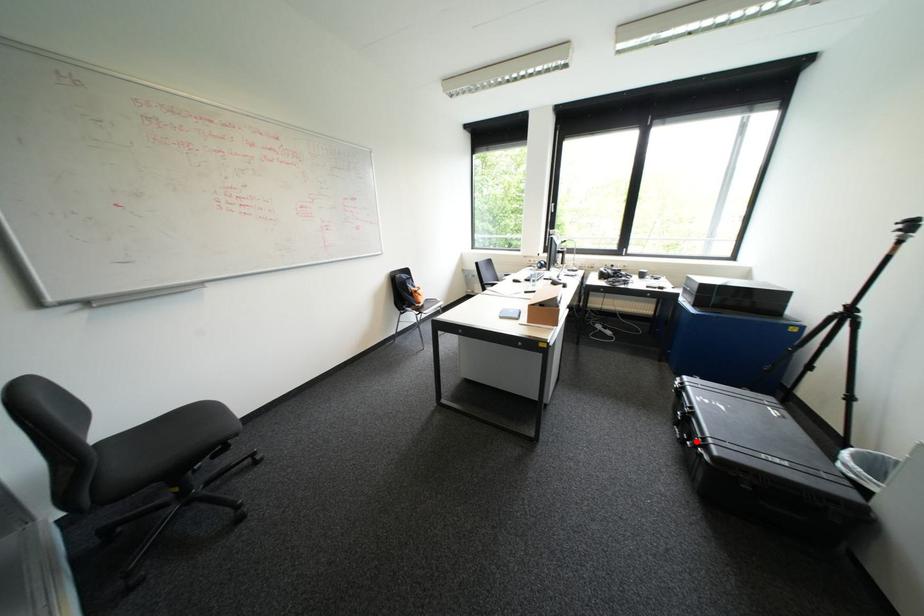
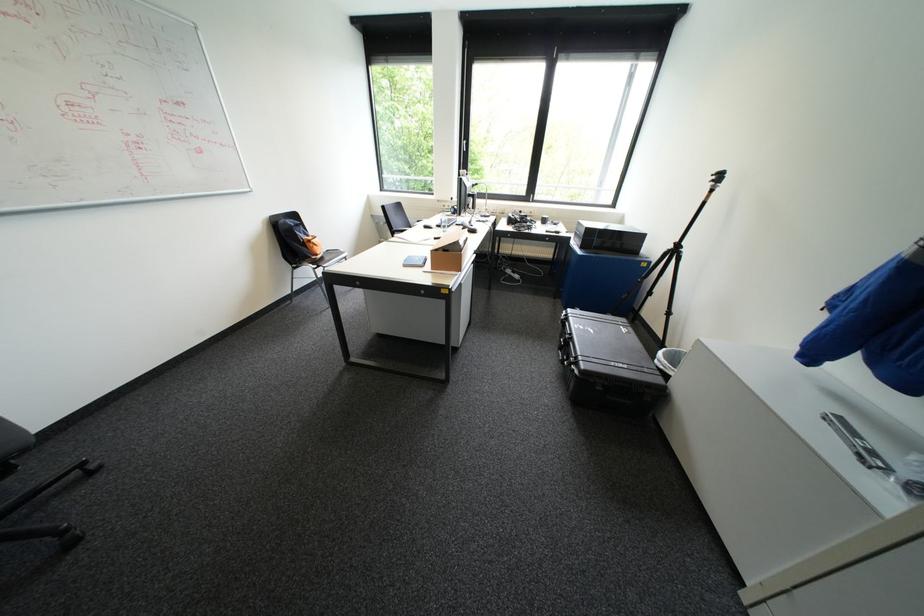
Question: A red point is marked in image1. In image2, is the corresponding 3D point closer to the camera or farther? Reply with the corresponding letter.

Choices:
 (A) The corresponding 3D point is closer.
 (B) The corresponding 3D point is farther.

Answer: (A)